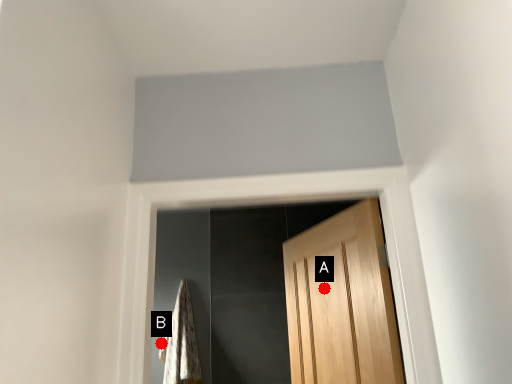
Question: Two points are circled on the image, labeled by A and B beside each circle. Which point is farther from the camera taking this photo?

Choices:
 (A) A is further
 (B) B is further

Answer: (B)